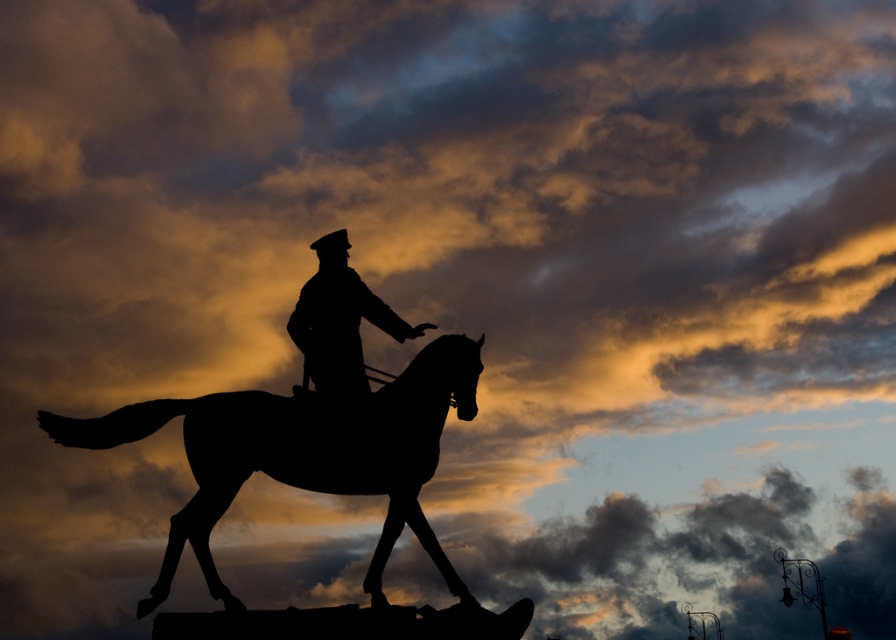
You are standing in front of the statue and notice a specific point marked at coordinates (303,452). Which part of the statue is located at this point?

The silhouette horse at center is located at point (303,452).